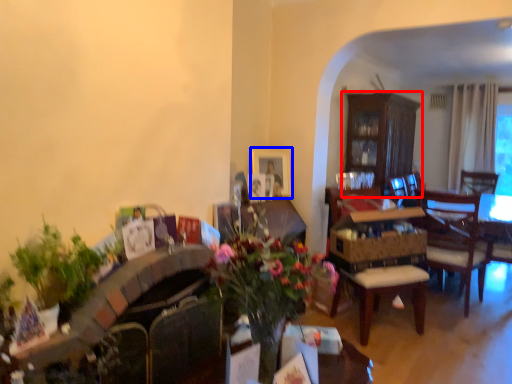
Question: Which of the following is the farthest to the observer, cabinetry (highlighted by a red box) or picture frame (highlighted by a blue box)?

Choices:
 (A) cabinetry
 (B) picture frame

Answer: (A)